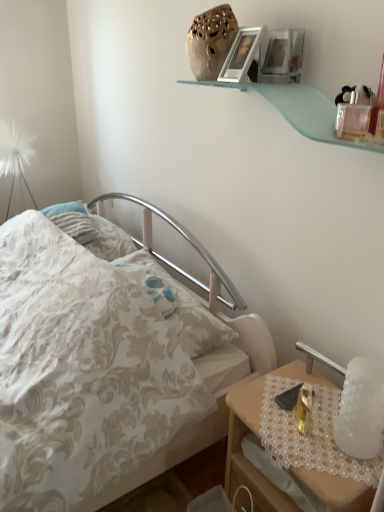
The width and height of the screenshot is (384, 512). What are the coordinates of `free space that is to the left of white frosted glass bedside lamp at right` in the screenshot? It's located at (299, 435).